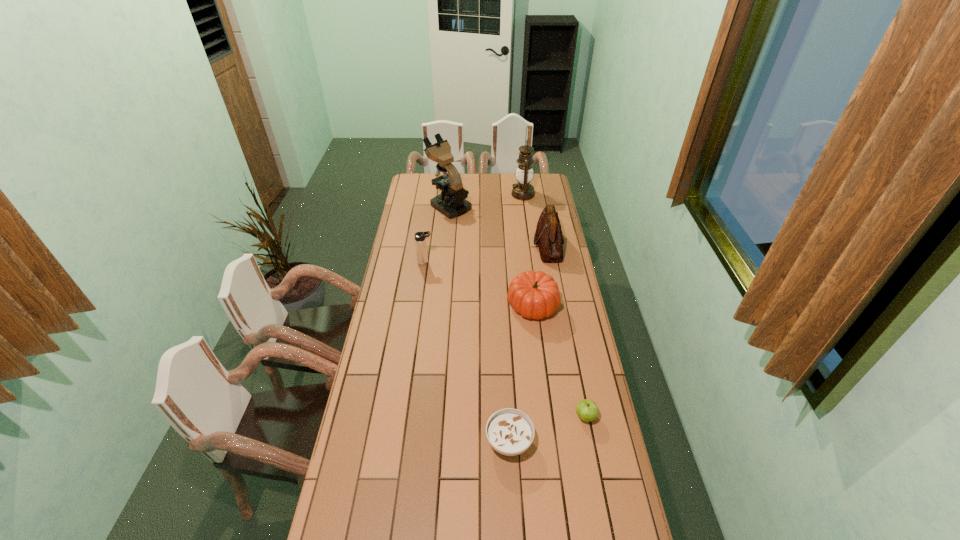
Locate an element on the screen. This screenshot has width=960, height=540. shoulder bag that is at the right edge is located at coordinates (548, 236).

You are a GUI agent. You are given a task and a screenshot of the screen. Output one action in this format:
    pyautogui.click(x=<x>, y=<y>)
    Task: Click on the pumpkin located in the right edge section of the desktop
    This screenshot has width=960, height=540.
    Given the screenshot: What is the action you would take?
    pyautogui.click(x=535, y=295)

At what (x,y) coordinates should I click in order to perform the action: click on apple that is at the right edge. Please return your answer as a coordinate pair (x, y). This screenshot has height=540, width=960. Looking at the image, I should click on pos(587,410).

Locate an element on the screen. This screenshot has width=960, height=540. object at the far left corner is located at coordinates (452, 203).

Locate an element on the screen. The image size is (960, 540). object located at the far right corner is located at coordinates (523, 190).

In the image, there is a desktop. Where is `free region at the far edge`? free region at the far edge is located at coordinates (510, 190).

I want to click on vacant region at the left edge of the desktop, so click(x=409, y=202).

Where is `free spot at the right edge of the desktop`? Image resolution: width=960 pixels, height=540 pixels. free spot at the right edge of the desktop is located at coordinates (563, 228).

This screenshot has height=540, width=960. I want to click on free space at the far right corner of the desktop, so click(x=543, y=178).

I want to click on vacant area between the soup bowl and the pumpkin, so click(x=520, y=373).